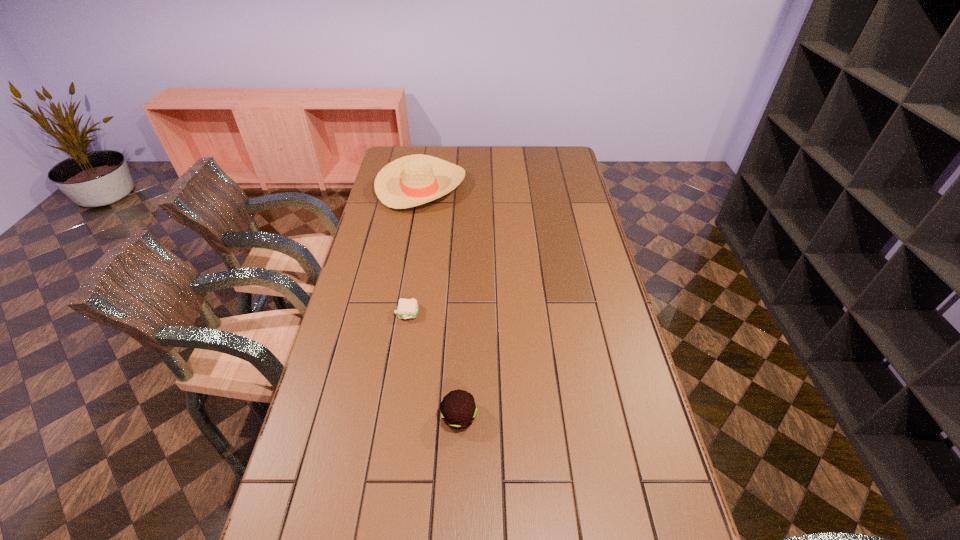
The height and width of the screenshot is (540, 960). Find the location of `the closest object to the right patty`. the closest object to the right patty is located at coordinates (407, 308).

Identify the location of object identified as the second closest to the taller patty. The width and height of the screenshot is (960, 540). (409, 181).

You are a GUI agent. You are given a task and a screenshot of the screen. Output one action in this format:
    pyautogui.click(x=<x>, y=<y>)
    Task: Click on the vacant space that satisfies the following two spatial constraints: 1. on the front side of the nearer patty; 2. on the right side of the second farthest object
    The height and width of the screenshot is (540, 960).
    Given the screenshot: What is the action you would take?
    pyautogui.click(x=392, y=417)